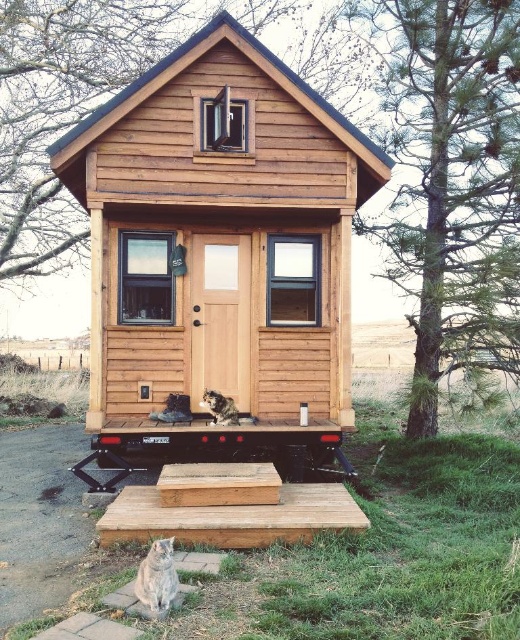
You are a visitor approaching the cabin and see the gray fur cat at lower left and the fuzzy brown cat at center. Which cat is taller?

The gray fur cat at lower left is taller than the fuzzy brown cat at center.

You are standing in front of the wooden cabin at center and want to see the gray fur cat at lower left. Where should you look relative to the cabin?

The gray fur cat at lower left is behind the wooden cabin at center, so you should look behind the cabin to find it.